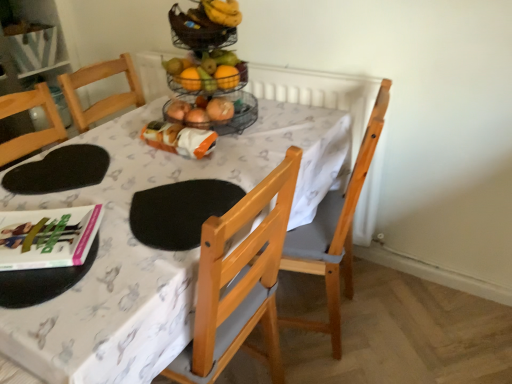
At what (x,y) coordinates should I click in order to perform the action: click on vacant space to the right of black foam mat at upper left. Please return your answer as a coordinate pair (x, y). Looking at the image, I should click on click(x=142, y=171).